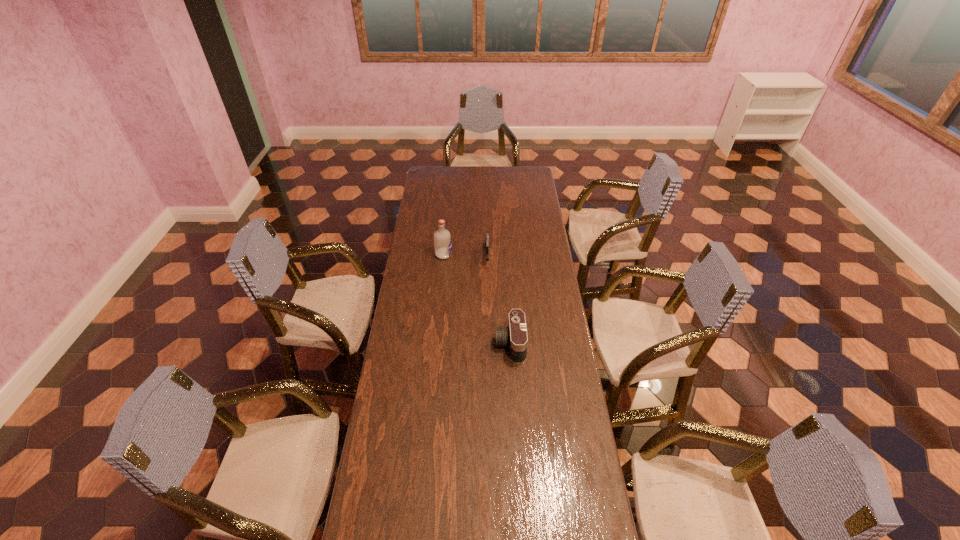
Find the location of a particular element. The height and width of the screenshot is (540, 960). vacant space located 0.160m at the muzzle end of the shortest object is located at coordinates (488, 293).

Find the location of a particular element. The height and width of the screenshot is (540, 960). object present at the left edge is located at coordinates (442, 239).

In the image, there is a desktop. Where is `vacant space at the far edge`? Image resolution: width=960 pixels, height=540 pixels. vacant space at the far edge is located at coordinates (475, 174).

Find the location of a particular element. The image size is (960, 540). vacant region at the left edge of the desktop is located at coordinates (397, 457).

Where is `vacant area at the right edge`? This screenshot has height=540, width=960. vacant area at the right edge is located at coordinates (546, 227).

This screenshot has width=960, height=540. Identify the location of free space at the far left corner of the desktop. (425, 166).

You are a GUI agent. You are given a task and a screenshot of the screen. Output one action in this format:
    pyautogui.click(x=<x>, y=<y>)
    Task: Click on the vacant space at the far right corner of the desktop
    The width and height of the screenshot is (960, 540).
    Given the screenshot: What is the action you would take?
    pyautogui.click(x=525, y=176)

At what (x,y) coordinates should I click in order to perform the action: click on free space between the second shortest object and the shortest object. Please return your answer as a coordinate pair (x, y). The height and width of the screenshot is (540, 960). Looking at the image, I should click on (498, 300).

The height and width of the screenshot is (540, 960). Find the location of `vacant region between the tallest object and the camera`. vacant region between the tallest object and the camera is located at coordinates (477, 299).

Image resolution: width=960 pixels, height=540 pixels. What are the coordinates of `free point between the second tallest object and the shortest object` in the screenshot? It's located at (498, 300).